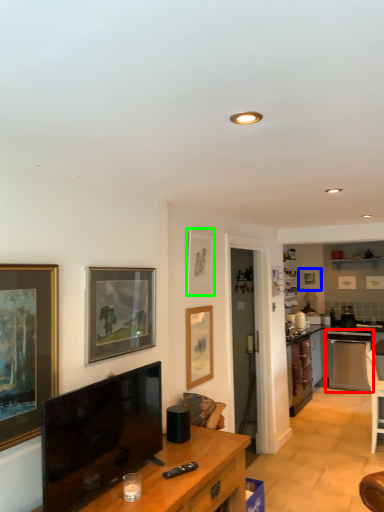
Question: Which is farther away from dish washer (highlighted by a red box)? picture frame (highlighted by a blue box) or picture frame (highlighted by a green box)?

Choices:
 (A) picture frame
 (B) picture frame

Answer: (B)